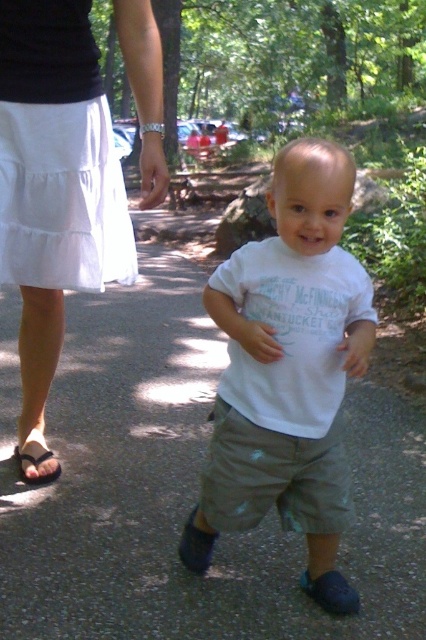
You are a fashion designer observing a child wearing a white cotton shirt at center and an adult wearing a white cotton skirt at lower left. Which clothing item is shorter in height?

The white cotton shirt at center has a lesser height compared to the white cotton skirt at lower left, so the white cotton shirt at center is shorter in height.

You are a photographer setting up a shoot in a park. You notice a child walking on a path with an adult nearby. You see the white cotton skirt at lower left and the brown leather sandal at lower left. Which object is positioned higher in the frame?

The white cotton skirt at lower left is taller than the brown leather sandal at lower left, so the white cotton skirt at lower left is positioned higher in the frame.

You are a fashion designer observing a child wearing a white cotton shirt at center and an adult wearing a white cotton skirt at lower left. Which clothing item is larger?

The white cotton skirt at lower left is larger than the white cotton shirt at center.